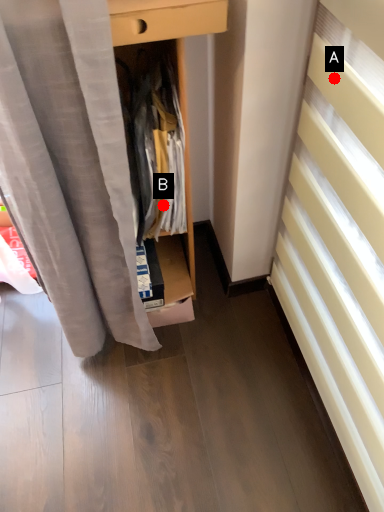
Question: Two points are circled on the image, labeled by A and B beside each circle. Among these points, which one is farthest from the camera?

Choices:
 (A) A is further
 (B) B is further

Answer: (B)